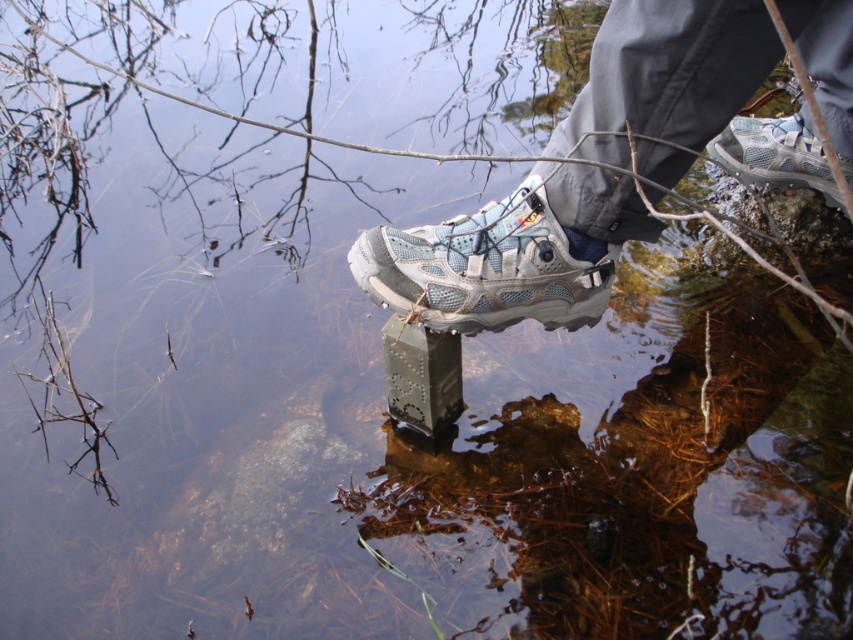
You are a photographer trying to capture a closeup shot of the matte gray shoe at center. Your camera lens is 36 inches away from the subject. Can you take the photo without moving the shoe?

The matte gray shoe at center is 37.44 inches away from the camera. Since your camera lens is only 36 inches away, you need to move the camera closer by 1.44 inches to capture the shoe without moving it.

You are a hiker trying to step onto a metallic sensor in the water. You have two shoes, the matte gray shoe at center and the matte gray mesh shoe at center. Which shoe should you remove to ensure your foot is fully visible for the sensor to scan?

The matte gray shoe at center is much taller than the matte gray mesh shoe at center, so you should remove the matte gray shoe at center to ensure your foot is fully visible.

You are a hiker trying to cross a shallow stream. You see two shoes in the water, a matte gray mesh shoe at center and a white mesh shoe at center. Which shoe has a wider base to provide better stability?

The matte gray mesh shoe at center has a wider base than the white mesh shoe at center, providing better stability for crossing the stream.